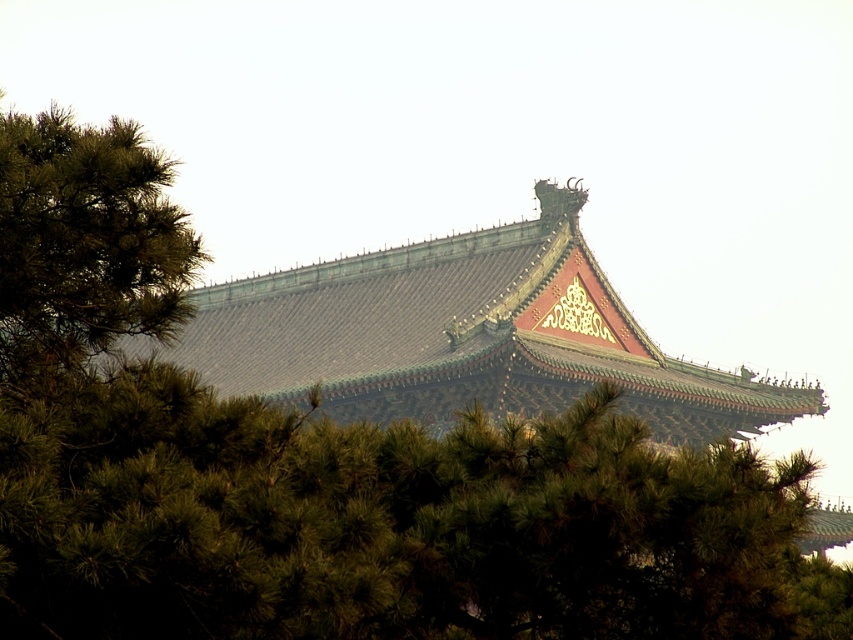
Does green matte pine tree at center have a lesser width compared to green glazed tile roof at center?

Yes.

Is green matte pine tree at center bigger than green glazed tile roof at center?

Actually, green matte pine tree at center might be smaller than green glazed tile roof at center.

Which is behind, point (236, 420) or point (535, 292)?

The point (535, 292) is behind.

In order to click on green matte pine tree at center in this screenshot , I will do `click(386, 524)`.

Can you confirm if green glazed tile roof at center is shorter than green leafy tree at left?

No, green glazed tile roof at center is not shorter than green leafy tree at left.

Is point (276, 362) behind point (120, 140)?

Yes, it is behind point (120, 140).

Measure the distance between point (178,349) and camera.

Point (178,349) is 120.21 meters away from camera.

Find the location of `green glazed tile roof at center`. green glazed tile roof at center is located at coordinates (465, 336).

Is green matte pine tree at center below green leafy tree at left?

Yes, green matte pine tree at center is below green leafy tree at left.

Is green matte pine tree at center thinner than green leafy tree at left?

No.

Is point (328, 433) in front of point (142, 160)?

That is False.

What are the coordinates of `green matte pine tree at center` in the screenshot? It's located at (386, 524).